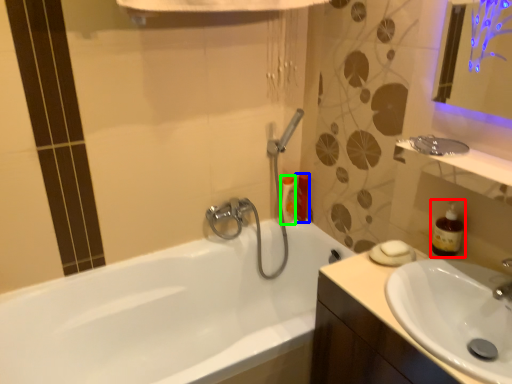
Question: Which object is positioned farthest from soap dispenser (highlighted by a red box)? Select from toiletry (highlighted by a blue box) and toiletry (highlighted by a green box).

Choices:
 (A) toiletry
 (B) toiletry

Answer: (B)